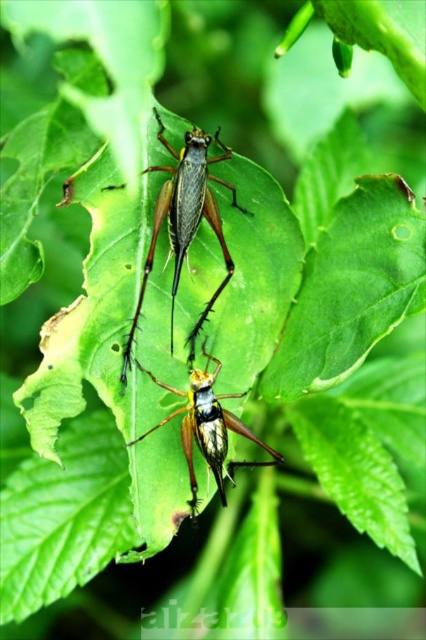
Does shiny green grasshopper at center appear on the left side of shiny metallic grasshopper at center?

Indeed, shiny green grasshopper at center is positioned on the left side of shiny metallic grasshopper at center.

Can you confirm if shiny green grasshopper at center is positioned to the right of shiny metallic grasshopper at center?

No, shiny green grasshopper at center is not to the right of shiny metallic grasshopper at center.

Describe the element at coordinates (184, 221) in the screenshot. I see `shiny green grasshopper at center` at that location.

Find the location of a particular element. This screenshot has width=426, height=640. shiny green grasshopper at center is located at coordinates (184, 221).